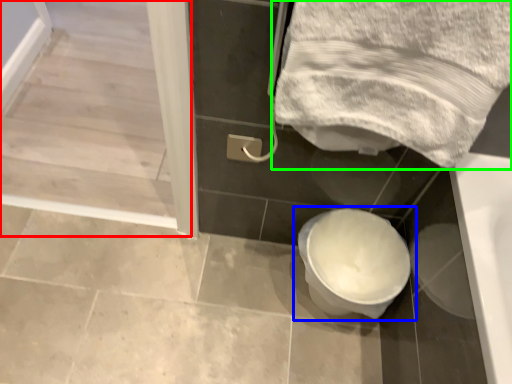
Question: Which is nearer to the screen door (highlighted by a red box)? toilet (highlighted by a blue box) or towel (highlighted by a green box).

Choices:
 (A) toilet
 (B) towel

Answer: (B)